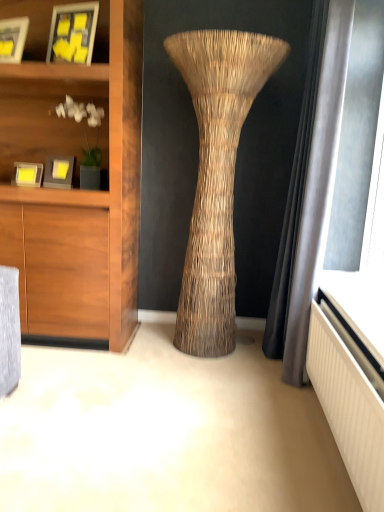
Question: From a real-world perspective, is matte yellow paper at upper left, the first picture frame viewed from the top, located beneath matte black picture frame at upper left, which ranks as the second picture frame in top-to-bottom order?

Choices:
 (A) yes
 (B) no

Answer: (B)

Question: Does matte yellow paper at upper left, the first picture frame viewed from the top, have a larger size compared to matte black picture frame at upper left, the third picture frame positioned from the bottom?

Choices:
 (A) no
 (B) yes

Answer: (B)

Question: Does matte yellow paper at upper left, the fourth picture frame in the bottom-to-top sequence, have a greater width compared to matte black picture frame at upper left, which ranks as the second picture frame in top-to-bottom order?

Choices:
 (A) yes
 (B) no

Answer: (B)

Question: Can you confirm if matte yellow paper at upper left, the first picture frame viewed from the top, is positioned to the right of matte black picture frame at upper left, the third picture frame positioned from the bottom?

Choices:
 (A) yes
 (B) no

Answer: (A)

Question: From the image's perspective, would you say matte yellow paper at upper left, the first picture frame viewed from the top, is shown under matte black picture frame at upper left, the third picture frame positioned from the bottom?

Choices:
 (A) yes
 (B) no

Answer: (B)

Question: Based on their sizes in the image, would you say matte yellow picture frame at left, the fourth picture frame positioned from the top, is bigger or smaller than matte black picture frame at upper left, the third picture frame positioned from the bottom?

Choices:
 (A) small
 (B) big

Answer: (A)

Question: From a real-world perspective, is matte yellow picture frame at left, the fourth picture frame positioned from the top, positioned above or below matte black picture frame at upper left, which ranks as the second picture frame in top-to-bottom order?

Choices:
 (A) above
 (B) below

Answer: (B)

Question: Looking at their shapes, would you say matte yellow picture frame at left, the fourth picture frame positioned from the top, is wider or thinner than matte black picture frame at upper left, which ranks as the second picture frame in top-to-bottom order?

Choices:
 (A) thin
 (B) wide

Answer: (A)

Question: Based on their positions, is matte yellow picture frame at left, arranged as the 1th picture frame when ordered from the bottom, located to the left or right of matte black picture frame at upper left, which ranks as the second picture frame in top-to-bottom order?

Choices:
 (A) left
 (B) right

Answer: (B)

Question: Does point (92, 24) appear closer or farther from the camera than point (64, 160)?

Choices:
 (A) closer
 (B) farther

Answer: (A)

Question: From the image's perspective, is matte yellow paper at upper left, the first picture frame viewed from the top, located above or below matte gray picture frame at left, arranged as the 3th picture frame when viewed from the top?

Choices:
 (A) above
 (B) below

Answer: (A)

Question: Would you say matte yellow paper at upper left, the fourth picture frame in the bottom-to-top sequence, is inside or outside matte gray picture frame at left, arranged as the 3th picture frame when viewed from the top?

Choices:
 (A) inside
 (B) outside

Answer: (B)

Question: Looking at their shapes, would you say matte yellow paper at upper left, the first picture frame viewed from the top, is wider or thinner than matte gray picture frame at left, arranged as the 3th picture frame when viewed from the top?

Choices:
 (A) thin
 (B) wide

Answer: (A)

Question: Is matte gray shelf at upper left spatially inside matte yellow picture frame at left, arranged as the 1th picture frame when ordered from the bottom, or outside of it?

Choices:
 (A) inside
 (B) outside

Answer: (B)

Question: Based on their positions, is matte gray shelf at upper left located to the left or right of matte yellow picture frame at left, the fourth picture frame positioned from the top?

Choices:
 (A) left
 (B) right

Answer: (B)